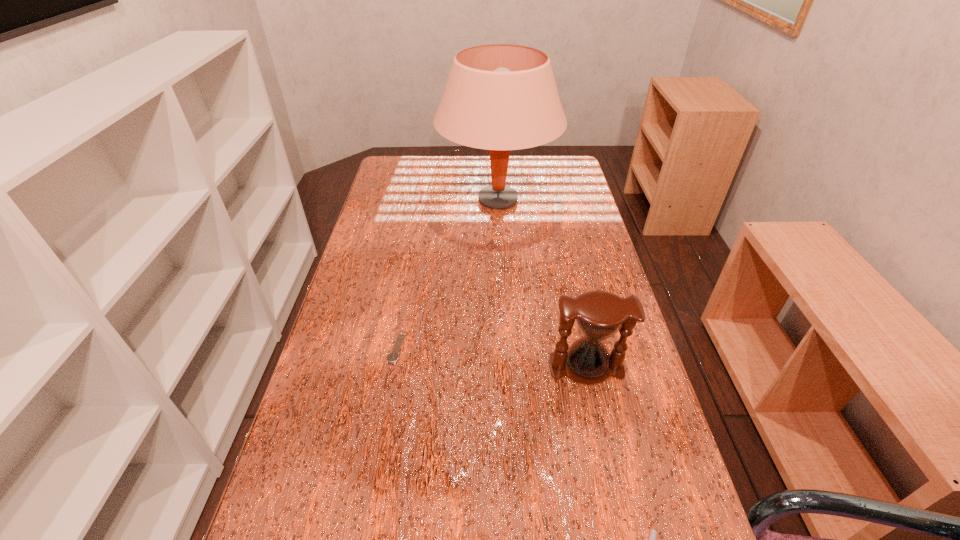
Find the location of a particular element. object that is at the far edge is located at coordinates click(x=500, y=97).

The image size is (960, 540). Identify the location of object present at the left edge. (393, 356).

This screenshot has height=540, width=960. I want to click on lampshade that is at the right edge, so click(x=500, y=97).

This screenshot has height=540, width=960. I want to click on hourglass located in the right edge section of the desktop, so click(600, 315).

This screenshot has width=960, height=540. In order to click on object that is at the far right corner in this screenshot , I will do `click(500, 97)`.

What are the coordinates of `vacant space at the far edge of the desktop` in the screenshot? It's located at (435, 184).

Locate an element on the screen. Image resolution: width=960 pixels, height=540 pixels. vacant area at the left edge of the desktop is located at coordinates (390, 321).

This screenshot has height=540, width=960. I want to click on free space at the right edge of the desktop, so click(594, 425).

Where is `vacant space at the far left corner`? vacant space at the far left corner is located at coordinates (409, 159).

Where is `vacant area at the far right corner`? This screenshot has height=540, width=960. vacant area at the far right corner is located at coordinates (562, 159).